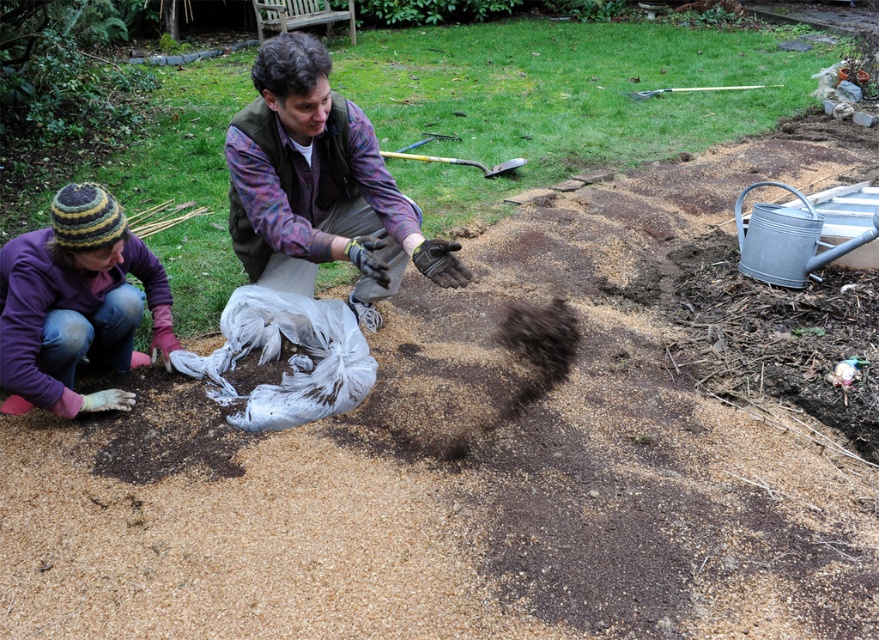
Question: Considering the relative positions of flannel shirt at center and metallic silver shovel at upper center in the image provided, where is flannel shirt at center located with respect to metallic silver shovel at upper center?

Choices:
 (A) left
 (B) right

Answer: (A)

Question: Among these objects, which one is farthest from the camera?

Choices:
 (A) flannel shirt at center
 (B) metallic silver shovel at upper center

Answer: (B)

Question: Based on their relative distances, which object is nearer to the purple woolen hat at lower left?

Choices:
 (A) metallic silver shovel at upper center
 (B) flannel shirt at center

Answer: (B)

Question: Does flannel shirt at center have a lesser width compared to metallic silver shovel at upper center?

Choices:
 (A) yes
 (B) no

Answer: (A)

Question: Considering the real-world distances, which object is closest to the metallic silver shovel at upper center?

Choices:
 (A) flannel shirt at center
 (B) purple woolen hat at lower left

Answer: (A)

Question: Does purple woolen hat at lower left appear over metallic silver shovel at upper center?

Choices:
 (A) no
 (B) yes

Answer: (A)